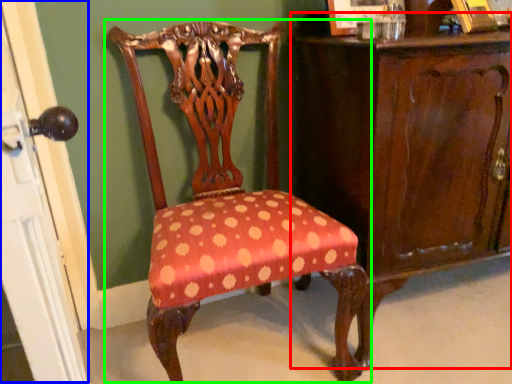
Question: Based on their relative distances, which object is nearer to vanity (highlighted by a red box)? Choose from screen door (highlighted by a blue box) and chair (highlighted by a green box).

Choices:
 (A) screen door
 (B) chair

Answer: (B)